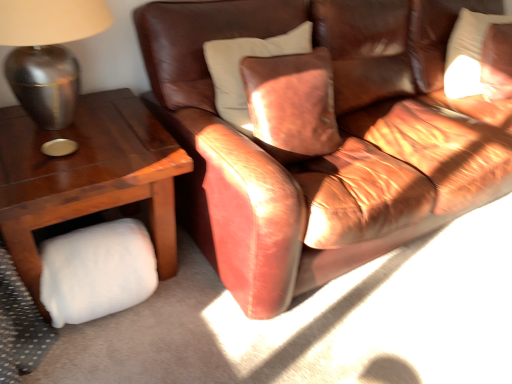
Locate an element on the screen. The width and height of the screenshot is (512, 384). leather couch at center is located at coordinates (325, 155).

Is woodenobject at left facing towards white soft pillow at upper right?

No, woodenobject at left is not aimed at white soft pillow at upper right.

Does woodenobject at left lie in front of white soft pillow at upper right?

That is True.

From the picture: Is the surface of woodenobject at left in direct contact with white soft pillow at upper right?

No, woodenobject at left is not with white soft pillow at upper right.

Locate an element on the screen. The image size is (512, 384). table on the left of white soft pillow at upper right is located at coordinates (87, 176).

From a real-world perspective, which is physically above, metallic silver lamp at left or leather couch at center?

From a 3D spatial view, metallic silver lamp at left is above.

From the image's perspective, between metallic silver lamp at left and leather couch at center, who is located below?

metallic silver lamp at left, from the image's perspective.

The width and height of the screenshot is (512, 384). Find the location of `studio couch that appears above the metallic silver lamp at left (from the image's perspective)`. studio couch that appears above the metallic silver lamp at left (from the image's perspective) is located at coordinates (325, 155).

Is metallic silver lamp at left not inside leather couch at center?

Yes, metallic silver lamp at left is outside of leather couch at center.

Based on the photo, which of these two, white fluffy pillow at lower left or woodenobject at left, is wider?

Wider between the two is woodenobject at left.

Is point (61, 308) more distant than point (85, 178)?

Yes.

Is white fluffy pillow at lower left to the left or to the right of woodenobject at left in the image?

Clearly, white fluffy pillow at lower left is on the right of woodenobject at left in the image.

Looking at the image, does white fluffy pillow at lower left seem bigger or smaller compared to woodenobject at left?

In the image, white fluffy pillow at lower left appears to be smaller than woodenobject at left.

Between white soft pillow at upper right and white fluffy pillow at lower left, which one has smaller size?

Smaller between the two is white fluffy pillow at lower left.

You are a GUI agent. You are given a task and a screenshot of the screen. Output one action in this format:
    pyautogui.click(x=<x>, y=<y>)
    Task: Click on the pillow above the white fluffy pillow at lower left (from the image's perspective)
    This screenshot has height=384, width=512.
    Given the screenshot: What is the action you would take?
    pyautogui.click(x=467, y=53)

From the picture: From the image's perspective, is white soft pillow at upper right on white fluffy pillow at lower left?

Yes, from the image's perspective, white soft pillow at upper right is over white fluffy pillow at lower left.

Can you tell me how much white soft pillow at upper right and white fluffy pillow at lower left differ in facing direction?

0.137 degrees separate the facing orientations of white soft pillow at upper right and white fluffy pillow at lower left.

Who is smaller, white soft pillow at upper right or leather couch at center?

With smaller size is white soft pillow at upper right.

How different are the orientations of white soft pillow at upper right and leather couch at center in degrees?

The angular difference between white soft pillow at upper right and leather couch at center is 3.5 degrees.

From a real-world perspective, is white soft pillow at upper right positioned above or below leather couch at center?

Clearly, from a real-world perspective, white soft pillow at upper right is above leather couch at center.

Considering the sizes of white soft pillow at upper right and leather couch at center in the image, is white soft pillow at upper right taller or shorter than leather couch at center?

white soft pillow at upper right is shorter than leather couch at center.

Is woodenobject at left inside white soft pillow at upper right?

No, white soft pillow at upper right does not contain woodenobject at left.

Can you confirm if white soft pillow at upper right is positioned to the left of woodenobject at left?

In fact, white soft pillow at upper right is to the right of woodenobject at left.

Is the position of white soft pillow at upper right more distant than that of woodenobject at left?

That is True.

From a real-world perspective, is white soft pillow at upper right under woodenobject at left?

No.

Between leather couch at center and woodenobject at left, which one has larger size?

With larger size is leather couch at center.

How far apart are leather couch at center and woodenobject at left?

20.32 inches.

What's the angular difference between leather couch at center and woodenobject at left's facing directions?

2.69 degrees separate the facing orientations of leather couch at center and woodenobject at left.

Considering the positions of objects leather couch at center and woodenobject at left in the image provided, who is behind, leather couch at center or woodenobject at left?

woodenobject at left is further from the camera.

The width and height of the screenshot is (512, 384). In the image, there is a woodenobject at left. What are the coordinates of `pillow above it (from the image's perspective)` in the screenshot? It's located at pyautogui.click(x=467, y=53).

The height and width of the screenshot is (384, 512). What are the coordinates of `studio couch lying on the right of metallic silver lamp at left` in the screenshot? It's located at (325, 155).

Based on their spatial positions, is leather couch at center or white fluffy pillow at lower left further from metallic silver lamp at left?

The object further to metallic silver lamp at left is leather couch at center.

Estimate the real-world distances between objects in this image. Which object is closer to white fluffy pillow at lower left, leather couch at center or metallic silver lamp at left?

metallic silver lamp at left.

From the image, which object appears to be nearer to metallic silver lamp at left, white fluffy pillow at lower left or leather couch at center?

white fluffy pillow at lower left is closer to metallic silver lamp at left.

From the image, which object appears to be nearer to white fluffy pillow at lower left, white soft pillow at upper right or metallic silver lamp at left?

metallic silver lamp at left is closer to white fluffy pillow at lower left.

Looking at the image, which one is located further to woodenobject at left, white fluffy pillow at lower left or white soft pillow at upper right?

white soft pillow at upper right is positioned further to the anchor woodenobject at left.

Based on their spatial positions, is leather couch at center or woodenobject at left further from white fluffy pillow at lower left?

Among the two, leather couch at center is located further to white fluffy pillow at lower left.

From the image, which object appears to be farther from woodenobject at left, leather couch at center or white soft pillow at upper right?

white soft pillow at upper right is further to woodenobject at left.

When comparing their distances from metallic silver lamp at left, does white fluffy pillow at lower left or white soft pillow at upper right seem further?

The object further to metallic silver lamp at left is white soft pillow at upper right.

I want to click on table between metallic silver lamp at left and white fluffy pillow at lower left in the vertical direction, so click(x=87, y=176).

This screenshot has height=384, width=512. Find the location of `toilet paper between woodenobject at left and leather couch at center from left to right`. toilet paper between woodenobject at left and leather couch at center from left to right is located at coordinates (97, 271).

Where is `table between metallic silver lamp at left and leather couch at center in the horizontal direction`? This screenshot has width=512, height=384. table between metallic silver lamp at left and leather couch at center in the horizontal direction is located at coordinates (87, 176).

This screenshot has width=512, height=384. Identify the location of studio couch located between woodenobject at left and white soft pillow at upper right in the left-right direction. (325, 155).